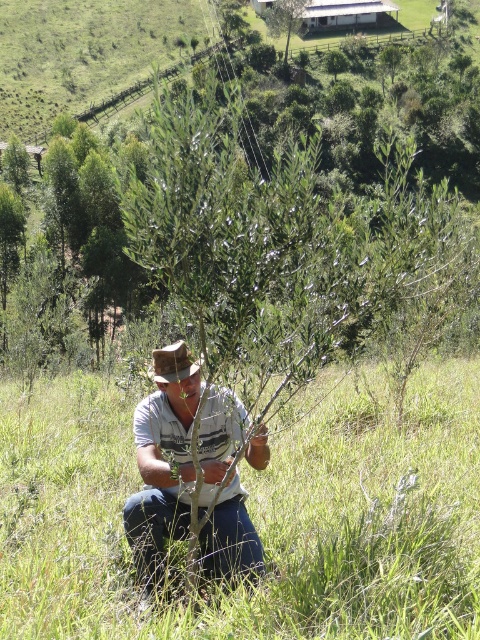
You are a photographer wanting to capture the green grass at center and the brown felt cowboy hat at center in your shot. Which object should you focus on if you want to emphasize the larger one in the frame?

The green grass at center is bigger than the brown felt cowboy hat at center, so you should focus on the green grass at center to emphasize the larger object.

You are a photographer trying to capture a closeup of the man in the scene. Since the green grass at center and white cotton shirt at center are in the frame, which one would you need to adjust your focus to ensure the man is clear?

The green grass at center is larger in size than the white cotton shirt at center, so adjusting focus on the green grass at center would help ensure the man is clear as it occupies more space in the frame.

You are standing at the point marked by the coordinates point (253, 516). Looking around, you see the man tending to a small tree and the wooden fence in the background. Which direction should you walk to reach the wooden fence?

Since the wooden fence is in the upper part of the image and the point (253, 516) is at the center, you should walk upwards to reach the wooden fence.